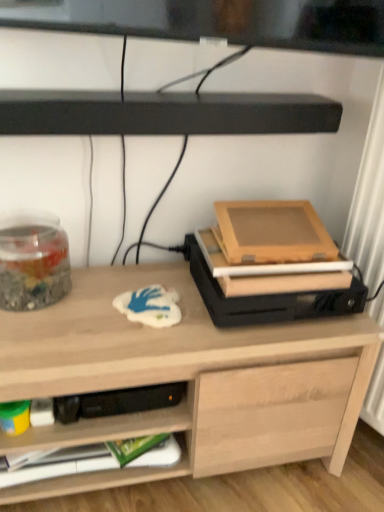
Describe the element at coordinates (33, 262) in the screenshot. I see `transparent glass jar at left` at that location.

At what (x,y) coordinates should I click in order to perform the action: click on black matte soundbar at upper center. Please return your answer as a coordinate pair (x, y). Looking at the image, I should click on (164, 113).

In the scene shown: From the image's perspective, between light wood desk at center and green matte paperback book at lower left, which one is located above?

light wood desk at center is shown above in the image.

Consider the image. Would you say green matte paperback book at lower left is part of light wood desk at center's contents?

Yes, green matte paperback book at lower left is a part of light wood desk at center.

Does light wood desk at center have a smaller size compared to green matte paperback book at lower left?

No, light wood desk at center is not smaller than green matte paperback book at lower left.

In the scene shown: Is light wood desk at center directly adjacent to green matte paperback book at lower left?

No, light wood desk at center is not with green matte paperback book at lower left.

Does black matte soundbar at upper center have a smaller size compared to green matte paperback book at lower left?

Incorrect, black matte soundbar at upper center is not smaller in size than green matte paperback book at lower left.

From the image's perspective, is black matte soundbar at upper center located above or below green matte paperback book at lower left?

Clearly, from the image's perspective, black matte soundbar at upper center is above green matte paperback book at lower left.

Does black matte soundbar at upper center appear on the left side of green matte paperback book at lower left?

Incorrect, black matte soundbar at upper center is not on the left side of green matte paperback book at lower left.

Is there a large distance between green matte paperback book at lower left and black matte soundbar at upper center?

No, there isn't a large distance between green matte paperback book at lower left and black matte soundbar at upper center.

Can you tell me how much green matte paperback book at lower left and black matte soundbar at upper center differ in facing direction?

The facing directions of green matte paperback book at lower left and black matte soundbar at upper center are 6.46e-05 degrees apart.

I want to click on shelf positioned vertically above the green matte paperback book at lower left (from a real-world perspective), so click(x=164, y=113).

Is green matte paperback book at lower left positioned before black matte soundbar at upper center?

No, it is not.

Considering the relative sizes of transparent glass jar at left and black matte soundbar at upper center in the image provided, is transparent glass jar at left shorter than black matte soundbar at upper center?

In fact, transparent glass jar at left may be taller than black matte soundbar at upper center.

Is transparent glass jar at left looking in the opposite direction of black matte soundbar at upper center?

No, transparent glass jar at left is not facing the opposite direction of black matte soundbar at upper center.

Between point (8, 252) and point (35, 102), which one is positioned in front?

Point (35, 102)

How different are the orientations of transparent glass jar at left and black matte soundbar at upper center in degrees?

The angular difference between transparent glass jar at left and black matte soundbar at upper center is 0.000209 degrees.

Locate an element on the screen. This screenshot has width=384, height=512. glass jar that appears behind the light wood desk at center is located at coordinates (33, 262).

Is light wood desk at center looking in the opposite direction of transparent glass jar at left?

No.

Considering the relative positions of light wood desk at center and transparent glass jar at left in the image provided, is light wood desk at center to the left or to the right of transparent glass jar at left?

Clearly, light wood desk at center is on the right of transparent glass jar at left in the image.

Considering the sizes of light wood desk at center and transparent glass jar at left in the image, is light wood desk at center wider or thinner than transparent glass jar at left?

In the image, light wood desk at center appears to be wider than transparent glass jar at left.

From a real-world perspective, is black matte soundbar at upper center beneath light wood desk at center?

No, from a real-world perspective, black matte soundbar at upper center is not under light wood desk at center.

Looking at this image, does black matte soundbar at upper center appear on the right side of light wood desk at center?

Correct, you'll find black matte soundbar at upper center to the right of light wood desk at center.

Looking at this image, measure the distance between black matte soundbar at upper center and light wood desk at center.

black matte soundbar at upper center and light wood desk at center are 20.48 inches apart from each other.

From a real-world perspective, who is located higher, light wood desk at center or black matte soundbar at upper center?

black matte soundbar at upper center.

How many degrees apart are the facing directions of light wood desk at center and black matte soundbar at upper center?

The facing directions of light wood desk at center and black matte soundbar at upper center are 0.000152 degrees apart.

Looking at this image, from the image's perspective, which is below, light wood desk at center or black matte soundbar at upper center?

light wood desk at center.

Locate an element on the screen. desk positioned vertically above the green matte paperback book at lower left (from a real-world perspective) is located at coordinates (187, 380).

Find the location of a particular element. This screenshot has width=384, height=512. shelf in front of the green matte paperback book at lower left is located at coordinates (164, 113).

Considering their positions, is black matte soundbar at upper center positioned further to light wood desk at center than green matte paperback book at lower left?

black matte soundbar at upper center lies further to light wood desk at center than the other object.

When comparing their distances from green matte paperback book at lower left, does light wood desk at center or black matte soundbar at upper center seem closer?

light wood desk at center is positioned closer to the anchor green matte paperback book at lower left.

Looking at the image, which one is located closer to transparent glass jar at left, black matte soundbar at upper center or light wood desk at center?

light wood desk at center.

Estimate the real-world distances between objects in this image. Which object is further from green matte paperback book at lower left, transparent glass jar at left or black matte soundbar at upper center?

black matte soundbar at upper center is positioned further to the anchor green matte paperback book at lower left.

Based on their spatial positions, is transparent glass jar at left or light wood desk at center closer to black matte soundbar at upper center?

transparent glass jar at left is closer to black matte soundbar at upper center.

When comparing their distances from black matte soundbar at upper center, does light wood desk at center or green matte paperback book at lower left seem closer?

light wood desk at center is positioned closer to the anchor black matte soundbar at upper center.

From the image, which object appears to be farther from light wood desk at center, transparent glass jar at left or green matte paperback book at lower left?

The object further to light wood desk at center is transparent glass jar at left.

When comparing their distances from green matte paperback book at lower left, does light wood desk at center or transparent glass jar at left seem closer?

light wood desk at center.

Locate an element on the screen. desk between black matte soundbar at upper center and green matte paperback book at lower left from top to bottom is located at coordinates (187, 380).

Identify the location of glass jar between black matte soundbar at upper center and light wood desk at center in the up-down direction. This screenshot has height=512, width=384. (33, 262).

The image size is (384, 512). Identify the location of glass jar between black matte soundbar at upper center and green matte paperback book at lower left in the up-down direction. (33, 262).

This screenshot has width=384, height=512. Find the location of `desk between transparent glass jar at left and green matte paperback book at lower left in the vertical direction`. desk between transparent glass jar at left and green matte paperback book at lower left in the vertical direction is located at coordinates (187, 380).